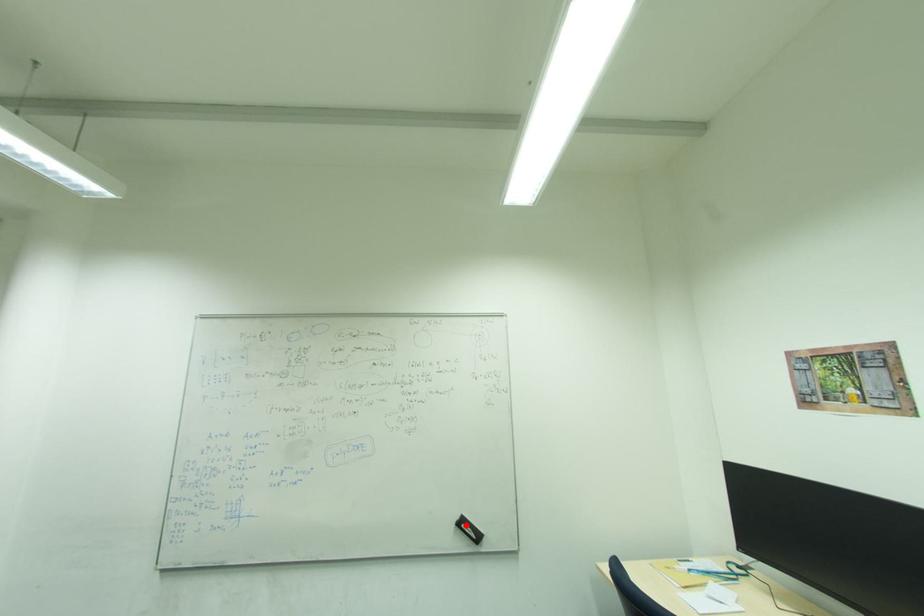
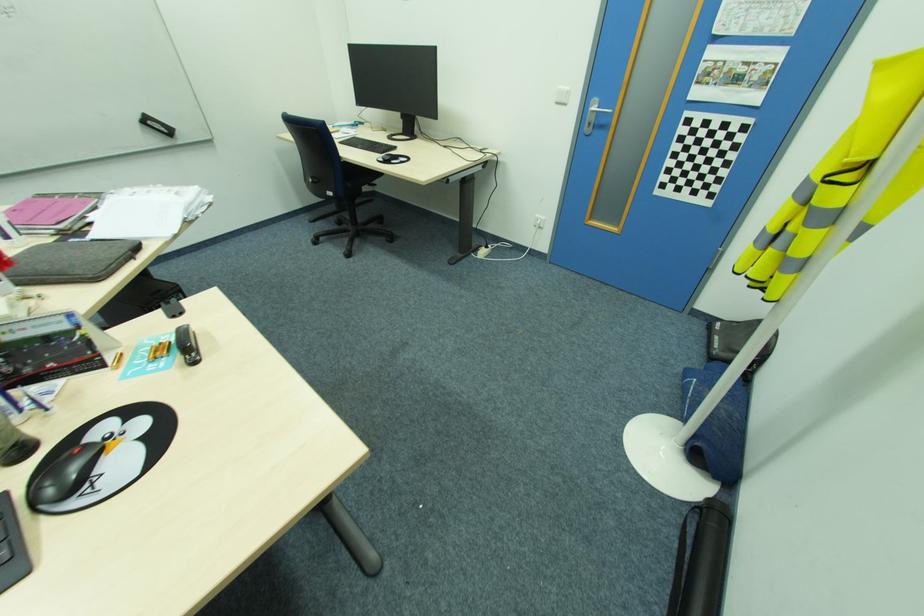
The point at the highlighted location is marked in the first image. Where is the corresponding point in the second image?

(151, 123)